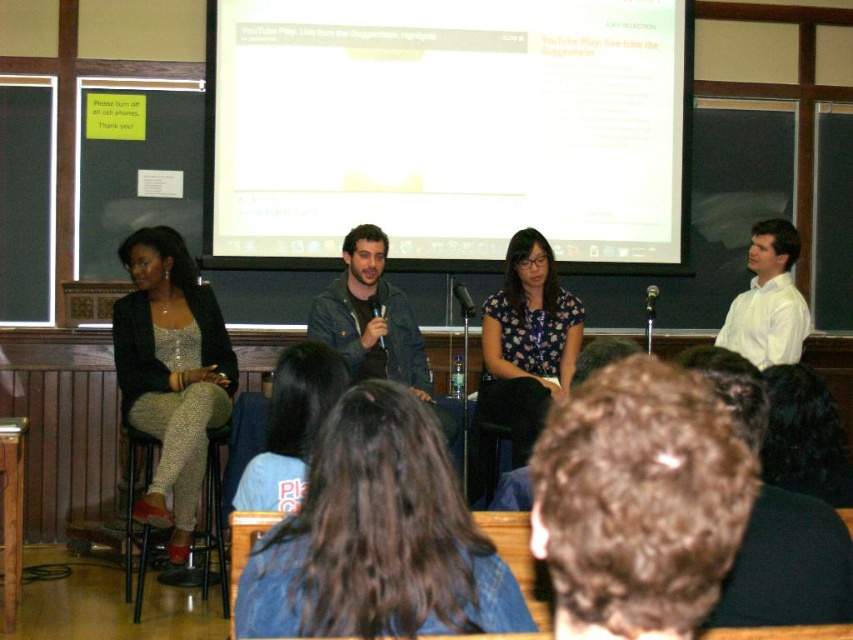
Who is positioned more to the right, white matte projection screen at upper center or dark brown hair at upper center?

Positioned to the right is dark brown hair at upper center.

Find the location of a particular element. Image resolution: width=853 pixels, height=640 pixels. white matte projection screen at upper center is located at coordinates (450, 131).

Can you confirm if dark brown hair at upper center is positioned to the left of light brown hair at center?

Incorrect, dark brown hair at upper center is not on the left side of light brown hair at center.

Does dark brown hair at upper center have a lesser width compared to light brown hair at center?

Incorrect, dark brown hair at upper center's width is not less than light brown hair at center's.

Locate an element on the screen. The height and width of the screenshot is (640, 853). dark brown hair at upper center is located at coordinates (639, 500).

From the picture: Does white matte projection screen at upper center have a greater height compared to floral print blouse at center?

Yes.

How distant is white matte projection screen at upper center from floral print blouse at center?

white matte projection screen at upper center is 88.91 centimeters away from floral print blouse at center.

Between point (440, 116) and point (538, 272), which one is positioned behind?

Positioned behind is point (440, 116).

Locate an element on the screen. The image size is (853, 640). white matte projection screen at upper center is located at coordinates (450, 131).